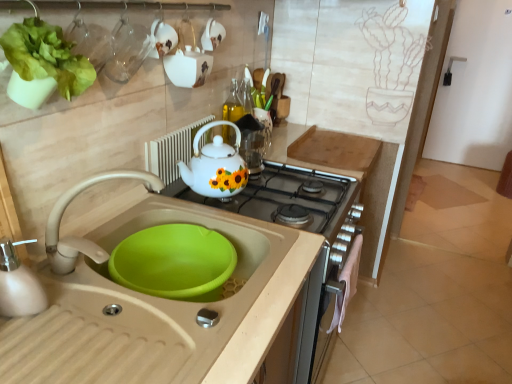
Question: Considering the relative sizes of beige plastic sink at lower left and white glossy teapot at upper center, the first appliance when ordered from top to bottom, in the image provided, is beige plastic sink at lower left taller than white glossy teapot at upper center, the first appliance when ordered from top to bottom,?

Choices:
 (A) yes
 (B) no

Answer: (B)

Question: From the image's perspective, would you say beige plastic sink at lower left is shown under white glossy teapot at upper center, which is the second appliance in bottom-to-top order?

Choices:
 (A) no
 (B) yes

Answer: (B)

Question: Considering the relative sizes of beige plastic sink at lower left and white glossy teapot at upper center, which is the second appliance in bottom-to-top order, in the image provided, is beige plastic sink at lower left shorter than white glossy teapot at upper center, which is the second appliance in bottom-to-top order,?

Choices:
 (A) no
 (B) yes

Answer: (B)

Question: Would you say white glossy teapot at upper center, which is the second appliance in bottom-to-top order, is part of beige plastic sink at lower left's contents?

Choices:
 (A) no
 (B) yes

Answer: (A)

Question: Considering the relative positions of beige plastic sink at lower left and white glossy teapot at upper center, which is the second appliance in bottom-to-top order, in the image provided, is beige plastic sink at lower left to the right of white glossy teapot at upper center, which is the second appliance in bottom-to-top order, from the viewer's perspective?

Choices:
 (A) no
 (B) yes

Answer: (A)

Question: Can you confirm if beige plastic sink at lower left is smaller than white glossy teapot at upper center, the first appliance when ordered from top to bottom?

Choices:
 (A) no
 (B) yes

Answer: (A)

Question: Is white glossy teapot at upper center, the first appliance when ordered from top to bottom, further to camera compared to white ceramic teapot at upper center, the second appliance from the top?

Choices:
 (A) yes
 (B) no

Answer: (B)

Question: Does white glossy teapot at upper center, the first appliance when ordered from top to bottom, have a greater width compared to white ceramic teapot at upper center, the second appliance from the top?

Choices:
 (A) yes
 (B) no

Answer: (A)

Question: From a real-world perspective, is white glossy teapot at upper center, the first appliance when ordered from top to bottom, on white ceramic teapot at upper center, the second appliance from the top?

Choices:
 (A) no
 (B) yes

Answer: (B)

Question: Is white glossy teapot at upper center, which is the second appliance in bottom-to-top order, to the left of white ceramic teapot at upper center, placed as the 1th appliance when sorted from bottom to top, from the viewer's perspective?

Choices:
 (A) yes
 (B) no

Answer: (B)

Question: Considering the relative sizes of white glossy teapot at upper center, the first appliance when ordered from top to bottom, and white ceramic teapot at upper center, the second appliance from the top, in the image provided, is white glossy teapot at upper center, the first appliance when ordered from top to bottom, bigger than white ceramic teapot at upper center, the second appliance from the top,?

Choices:
 (A) no
 (B) yes

Answer: (B)

Question: Are white glossy teapot at upper center, which is the second appliance in bottom-to-top order, and white ceramic teapot at upper center, the second appliance from the top, far apart?

Choices:
 (A) no
 (B) yes

Answer: (A)

Question: Is beige plastic sink at lower left bigger than white glossy teapot at center?

Choices:
 (A) no
 (B) yes

Answer: (B)